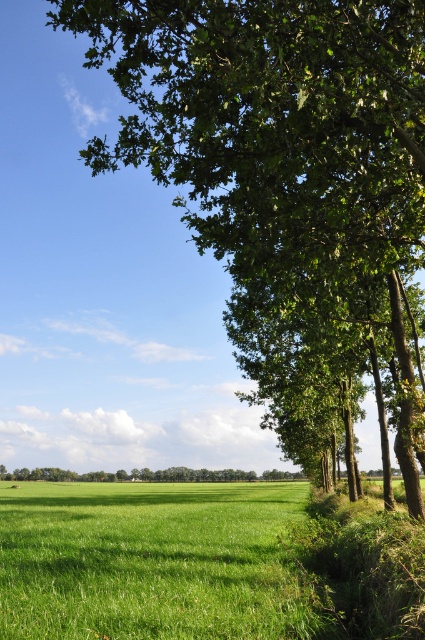
Question: Which is farther from the green leafy tree at lower right?

Choices:
 (A) green grassy field at lower left
 (B) green leafy tree at upper right

Answer: (B)

Question: Which of these objects is positioned farthest from the green leafy tree at lower right?

Choices:
 (A) green grassy field at lower left
 (B) green leafy tree at upper right

Answer: (B)

Question: Does green leafy tree at upper right appear on the left side of green leafy tree at lower right?

Choices:
 (A) no
 (B) yes

Answer: (A)

Question: Considering the relative positions of green leafy tree at upper right and green leafy tree at lower right in the image provided, where is green leafy tree at upper right located with respect to green leafy tree at lower right?

Choices:
 (A) right
 (B) left

Answer: (A)

Question: Estimate the real-world distances between objects in this image. Which object is closer to the green grassy field at lower left?

Choices:
 (A) green leafy tree at lower right
 (B) green leafy tree at upper right

Answer: (B)

Question: Does green leafy tree at upper right appear on the left side of green grassy field at lower left?

Choices:
 (A) yes
 (B) no

Answer: (A)